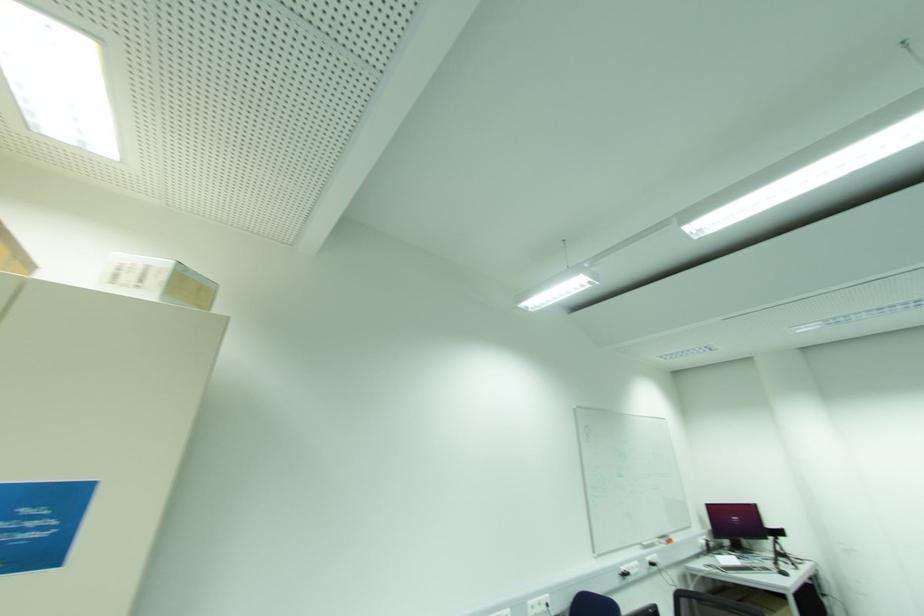
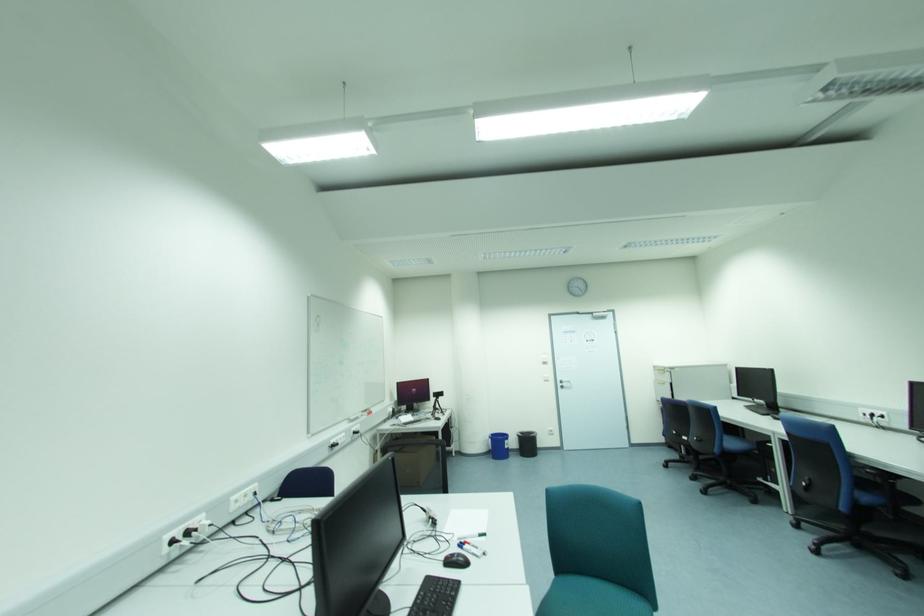
Question: The camera is either moving clockwise (left) or counter-clockwise (right) around the object. The first image is from the beginning of the video and the second image is from the end. Is the camera moving left or right when shooting the video?

Choices:
 (A) Left
 (B) Right

Answer: (A)